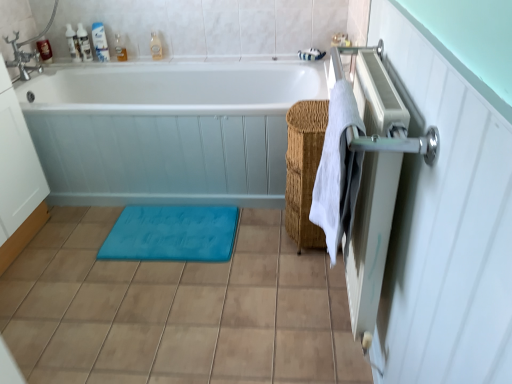
Image resolution: width=512 pixels, height=384 pixels. What are the coordinates of `vacant area that lies between woven brown basket at center-right and blue rubber bath mat at center` in the screenshot? It's located at (260, 229).